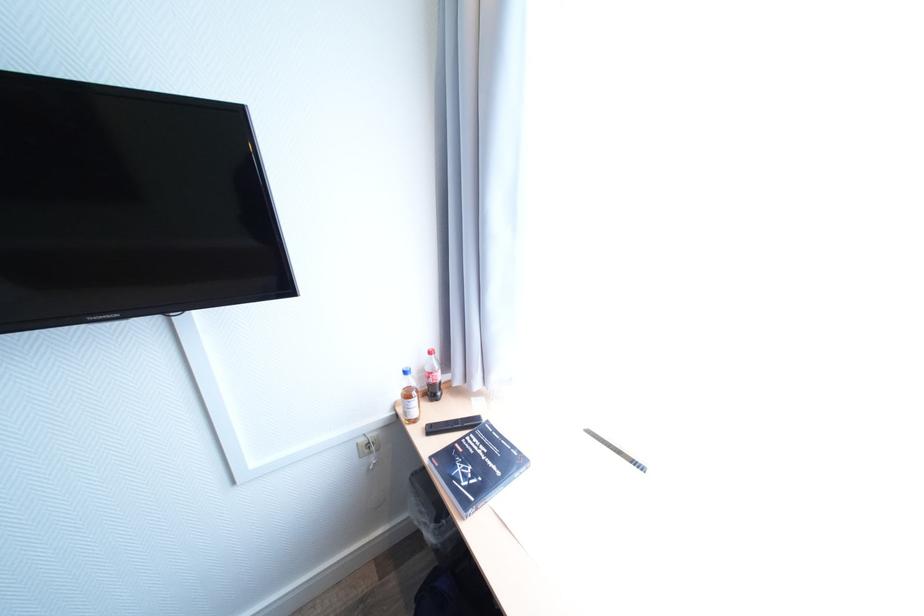
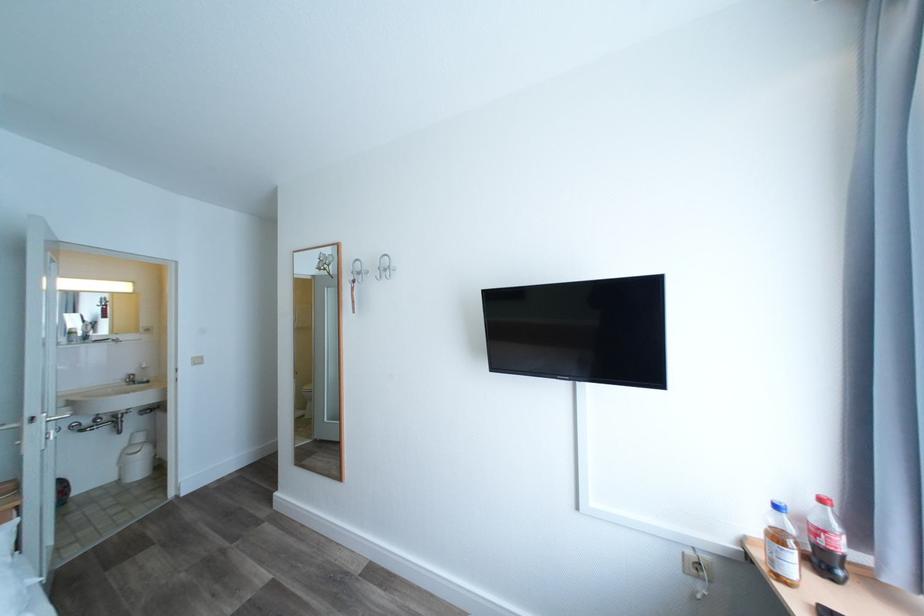
Question: The camera is either moving clockwise (left) or counter-clockwise (right) around the object. The first image is from the beginning of the video and the second image is from the end. Is the camera moving left or right when shooting the video?

Choices:
 (A) Left
 (B) Right

Answer: (B)